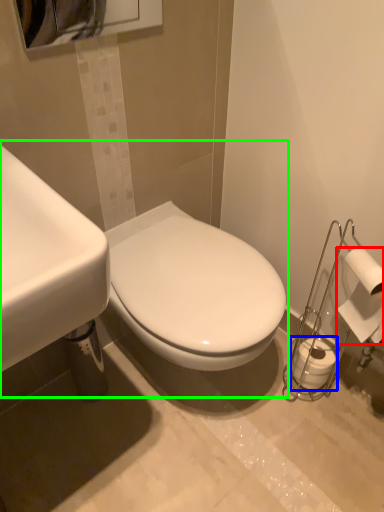
Question: Which object is positioned closest to toilet paper (highlighted by a red box)? Select from toilet paper (highlighted by a blue box) and sink (highlighted by a green box).

Choices:
 (A) toilet paper
 (B) sink

Answer: (A)